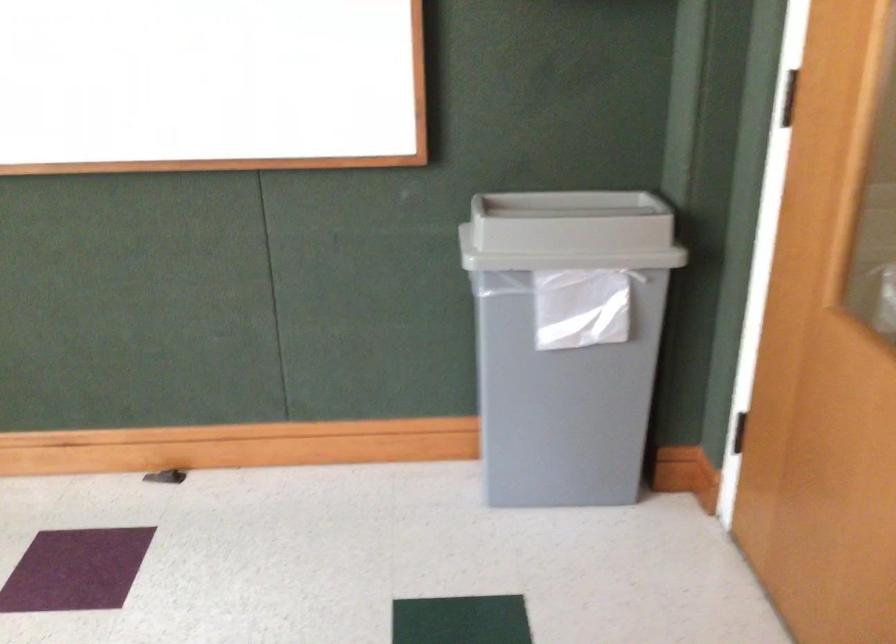
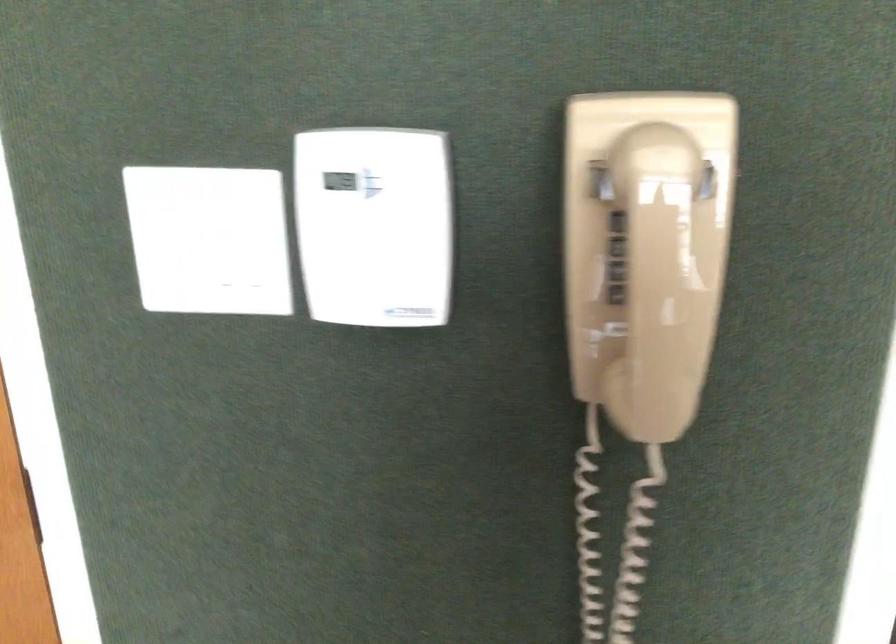
Based on the continuous images, in which direction is the camera rotating?

The camera rotated toward right-down.